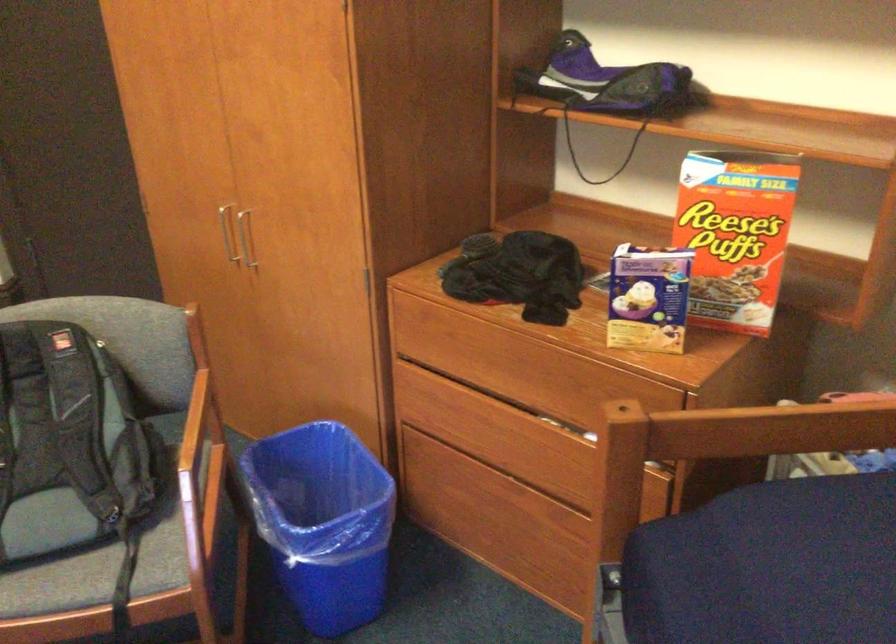
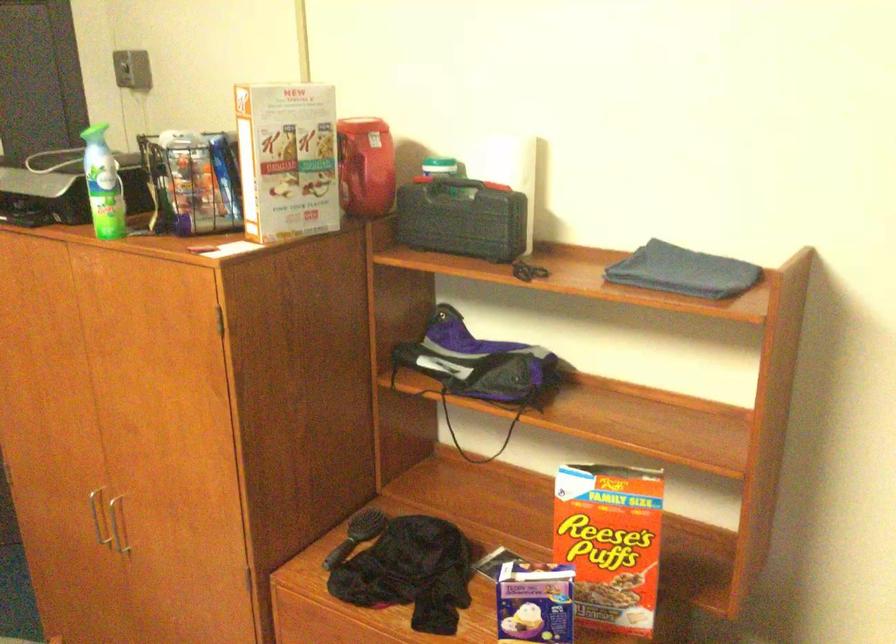
Question: What movement of the cameraman would produce the second image?

Choices:
 (A) Left
 (B) Right
 (C) Forward
 (D) Backward

Answer: (D)